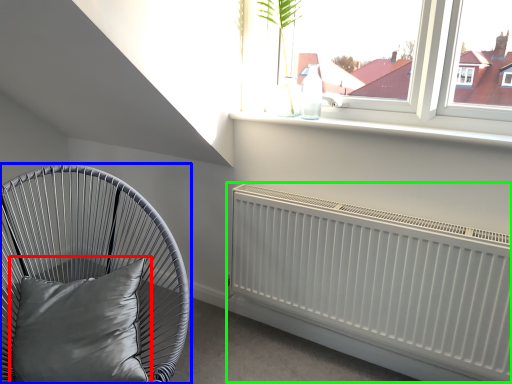
Question: Based on their relative distances, which object is nearer to pillow (highlighted by a red box)? Choose from furniture (highlighted by a blue box) and radiator (highlighted by a green box).

Choices:
 (A) furniture
 (B) radiator

Answer: (A)